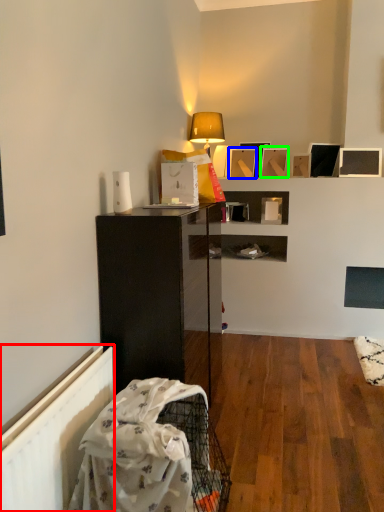
Question: Which is farther away from radiator (highlighted by a red box)? picture frame (highlighted by a blue box) or picture frame (highlighted by a green box)?

Choices:
 (A) picture frame
 (B) picture frame

Answer: (B)